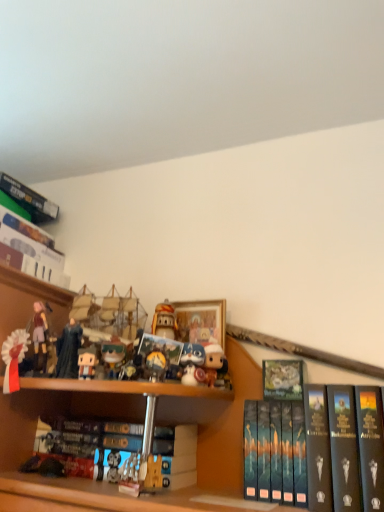
Question: In the image, is hardcover book at upper center, the second book positioned from the right, positioned in front of or behind hardcover book at center, which is counted as the 3th book, starting from the right?

Choices:
 (A) front
 (B) behind

Answer: (B)

Question: Considering the positions of hardcover book at upper center, the 2th book in the left-to-right sequence, and hardcover book at center, arranged as the 1th book when viewed from the left, in the image, is hardcover book at upper center, the 2th book in the left-to-right sequence, wider or thinner than hardcover book at center, arranged as the 1th book when viewed from the left,?

Choices:
 (A) wide
 (B) thin

Answer: (B)

Question: Which object is the closest to the wooden framed picture at center?

Choices:
 (A) white plush toy at center, the sixth toy in the left-to-right sequence
 (B) matte plastic figurine at center, the 3th toy when ordered from right to left
 (C) hardcover book at right, the 3th book in the left-to-right sequence
 (D) matte plastic figurine at center, which is the third toy in left-to-right order
 (E) white fabric ribbon at upper left, the 6th toy in the right-to-left sequence

Answer: (A)

Question: Which is farther from the matte black figurine at center, arranged as the 2th toy when viewed from the left?

Choices:
 (A) matte plastic figurine at center, the 3th toy when ordered from right to left
 (B) white fabric ribbon at upper left, which is the 1th toy from left to right
 (C) hardcover book at right, the 3th book in the left-to-right sequence
 (D) matte plastic figurine at center, which is the third toy in left-to-right order
 (E) matte plastic figurine at center, the 2th toy viewed from the right

Answer: (C)